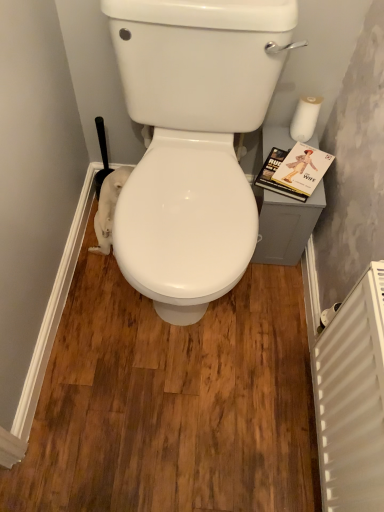
The image size is (384, 512). What are the coordinates of `blank space situated above hardcover book at right (from a real-world perspective)` in the screenshot? It's located at (308, 168).